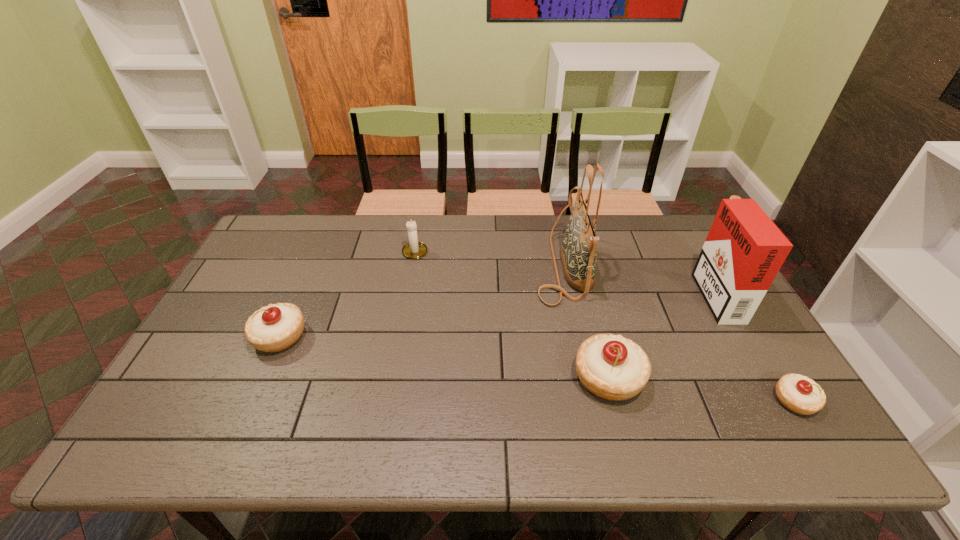
Locate an element on the screen. candle holder at the far edge is located at coordinates (413, 250).

Identify the location of handbag situated at the far edge. The height and width of the screenshot is (540, 960). (578, 252).

Locate an element on the screen. The height and width of the screenshot is (540, 960). object at the left edge is located at coordinates (276, 327).

You are a GUI agent. You are given a task and a screenshot of the screen. Output one action in this format:
    pyautogui.click(x=<x>, y=<y>)
    Task: Click on the pastry that is positioned at the right edge
    
    Given the screenshot: What is the action you would take?
    pyautogui.click(x=799, y=394)

This screenshot has width=960, height=540. Identify the location of cigarette case positioned at the right edge. (744, 250).

I want to click on object located at the near right corner, so click(x=799, y=394).

In the image, there is a desktop. At what (x,y) coordinates should I click in order to perform the action: click on blank space at the far edge. Please return your answer as a coordinate pair (x, y). This screenshot has height=540, width=960. Looking at the image, I should click on (x=393, y=249).

The image size is (960, 540). Find the location of `free space at the near edge of the desktop`. free space at the near edge of the desktop is located at coordinates (527, 399).

In the image, there is a desktop. What are the coordinates of `free space at the left edge` in the screenshot? It's located at (255, 274).

Locate an element on the screen. vacant space at the right edge of the desktop is located at coordinates (734, 364).